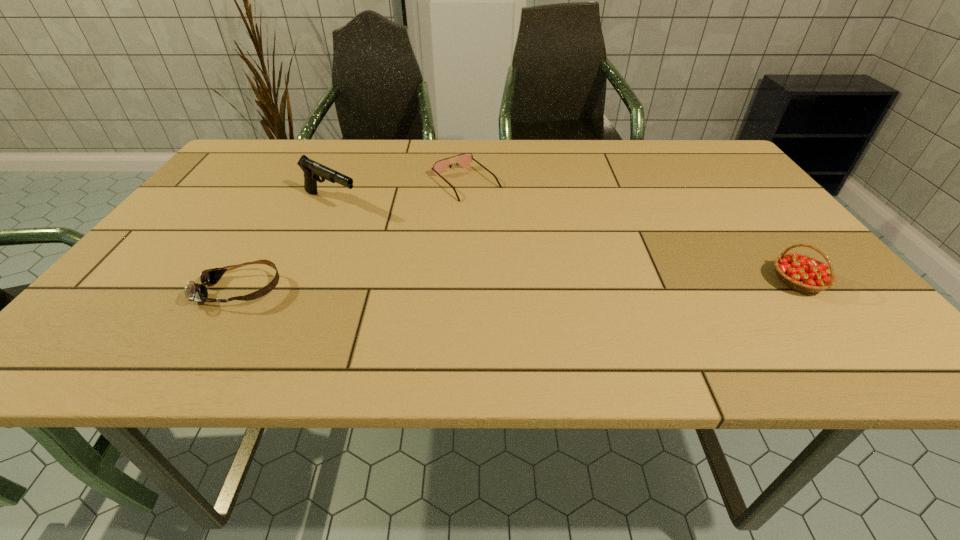
At what (x,y) coordinates should I click in order to perform the action: click on vacant space located 0.350m at the aiming end of the tallest object. Please return your answer as a coordinate pair (x, y). Looking at the image, I should click on (464, 267).

Locate an element on the screen. The height and width of the screenshot is (540, 960). vacant point located at the aiming end of the tallest object is located at coordinates (478, 274).

Find the location of `vacant region located 0.240m on the bridge of the second object from right to left`. vacant region located 0.240m on the bridge of the second object from right to left is located at coordinates (542, 248).

Identify the location of vacant area situated 0.070m on the bridge of the second object from right to left. The width and height of the screenshot is (960, 540). (500, 212).

The width and height of the screenshot is (960, 540). Find the location of `vacant area situated 0.190m on the bridge of the second object from right to left`. vacant area situated 0.190m on the bridge of the second object from right to left is located at coordinates (529, 237).

Identify the location of object at the far edge. This screenshot has height=540, width=960. (464, 160).

Where is `goggles situated at the near edge`? goggles situated at the near edge is located at coordinates (193, 291).

The width and height of the screenshot is (960, 540). Identify the location of strawberry that is positioned at the near edge. (800, 272).

Where is `object at the right edge`? The height and width of the screenshot is (540, 960). object at the right edge is located at coordinates (800, 272).

The height and width of the screenshot is (540, 960). In order to click on object at the near right corner in this screenshot , I will do click(800, 272).